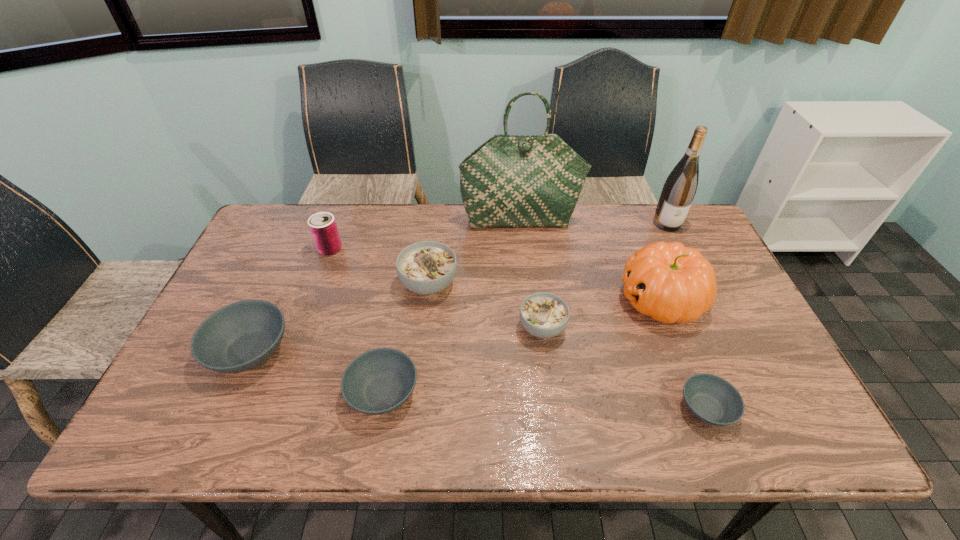
Find the location of a particular element. the tallest object is located at coordinates (510, 181).

I want to click on green tote bag, so click(x=510, y=181).

Identify the location of wine bottle. This screenshot has width=960, height=540. (678, 192).

Where is `the second tallest object`? the second tallest object is located at coordinates (678, 192).

You are a GUI agent. You are given a task and a screenshot of the screen. Output one action in this format:
    pyautogui.click(x=<x>, y=<y>)
    Task: Click on the seventh shortest object
    The width and height of the screenshot is (960, 540).
    Given the screenshot: What is the action you would take?
    pyautogui.click(x=671, y=283)

Image resolution: width=960 pixels, height=540 pixels. What are the coordinates of `orange pumpkin` in the screenshot? It's located at (671, 283).

Find the location of `can`. can is located at coordinates (323, 228).

Where is `the third farthest object`? Image resolution: width=960 pixels, height=540 pixels. the third farthest object is located at coordinates (323, 228).

What are the coordinates of `the bigger white soup bowl` in the screenshot? It's located at (428, 267).

What are the coordinates of `the tallest soup bowl` in the screenshot? It's located at (428, 267).